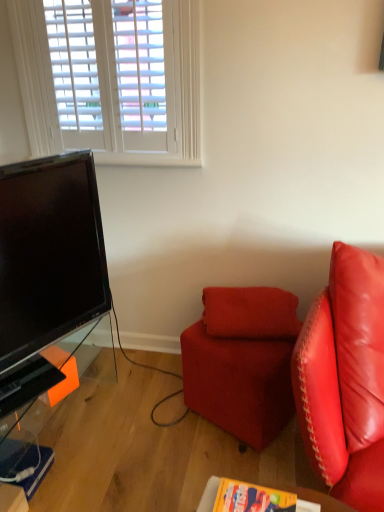
This screenshot has height=512, width=384. Describe the element at coordinates (318, 502) in the screenshot. I see `wooden table at lower center, which ranks as the 1th table in right-to-left order` at that location.

Measure the distance between wooden table at lower center, which ranks as the 1th table in right-to-left order, and camera.

wooden table at lower center, which ranks as the 1th table in right-to-left order, and camera are 1.13 meters apart.

This screenshot has width=384, height=512. I want to click on suede-like red pillow at center, so click(x=250, y=313).

Find the location of a particular element. velvet red ottoman at center is located at coordinates (242, 361).

Looking at this image, from a real-world perspective, is velvet red ottoman at center physically located above or below suede-like red pillow at center?

Clearly, from a real-world perspective, velvet red ottoman at center is below suede-like red pillow at center.

Considering the sizes of objects velvet red ottoman at center and suede-like red pillow at center in the image provided, who is wider, velvet red ottoman at center or suede-like red pillow at center?

Wider between the two is velvet red ottoman at center.

Do you think velvet red ottoman at center is within suede-like red pillow at center, or outside of it?

velvet red ottoman at center lies outside suede-like red pillow at center.

Considering the positions of objects suede-like red pillow at center and velvet red ottoman at center in the image provided, who is more to the left, suede-like red pillow at center or velvet red ottoman at center?

velvet red ottoman at center.

Considering the sizes of objects suede-like red pillow at center and velvet red ottoman at center in the image provided, who is smaller, suede-like red pillow at center or velvet red ottoman at center?

suede-like red pillow at center.

Is suede-like red pillow at center wider or thinner than velvet red ottoman at center?

In the image, suede-like red pillow at center appears to be more narrow than velvet red ottoman at center.

Does velvet red ottoman at center turn towards wooden table at lower center, which appears as the second table when viewed from the left?

No, velvet red ottoman at center is not oriented towards wooden table at lower center, which appears as the second table when viewed from the left.

From a real-world perspective, which object stands above the other?

wooden table at lower center, which appears as the second table when viewed from the left, is physically above.

From the picture: Is velvet red ottoman at center located outside wooden table at lower center, which ranks as the 1th table in right-to-left order?

Yes, velvet red ottoman at center is located beyond the bounds of wooden table at lower center, which ranks as the 1th table in right-to-left order.

Is velvet red ottoman at center touching wooden table at lower center, which ranks as the second table in back-to-front order?

No, velvet red ottoman at center is not touching wooden table at lower center, which ranks as the second table in back-to-front order.

From a real-world perspective, is wooden table at lower center, which appears as the second table when viewed from the left, positioned over suede-like red pillow at center based on gravity?

No, from a real-world perspective, wooden table at lower center, which appears as the second table when viewed from the left, is not above suede-like red pillow at center.

The width and height of the screenshot is (384, 512). In order to click on the 1st table to the left when counting from the suede-like red pillow at center in this screenshot , I will do `click(318, 502)`.

Could suede-like red pillow at center be considered to be inside wooden table at lower center, which ranks as the second table in back-to-front order?

No, suede-like red pillow at center is not a part of wooden table at lower center, which ranks as the second table in back-to-front order.

From the image's perspective, is velvet red ottoman at center below transparent glass table at lower left, which is the 1th table from back to front?

No.

Considering the relative sizes of velvet red ottoman at center and transparent glass table at lower left, which is the 1th table from back to front, in the image provided, is velvet red ottoman at center thinner than transparent glass table at lower left, which is the 1th table from back to front,?

Indeed, velvet red ottoman at center has a lesser width compared to transparent glass table at lower left, which is the 1th table from back to front.

From the image's perspective, which table is the 1st one below the velvet red ottoman at center? Please provide its 2D coordinates.

[(24, 452)]

Does point (285, 348) come behind point (14, 441)?

No, it is not.

Are transparent glass table at lower left, which is the 1th table from back to front, and velvet red ottoman at center located far from each other?

They are positioned close to each other.

Is transparent glass table at lower left, marked as the first table in a left-to-right arrangement, to the right of velvet red ottoman at center from the viewer's perspective?

In fact, transparent glass table at lower left, marked as the first table in a left-to-right arrangement, is to the left of velvet red ottoman at center.

Is velvet red ottoman at center at the back of transparent glass table at lower left, which is the 1th table from back to front?

transparent glass table at lower left, which is the 1th table from back to front, does not have its back to velvet red ottoman at center.

Locate an element on the screen. table that is under the velvet red ottoman at center (from a real-world perspective) is located at coordinates (24, 452).

Is wooden table at lower center, which ranks as the 1th table in right-to-left order, at the left side of transparent glass table at lower left, which is the 1th table from back to front?

No.

Is wooden table at lower center, which ranks as the 1th table in right-to-left order, facing towards transparent glass table at lower left, the second table in the right-to-left sequence?

No, wooden table at lower center, which ranks as the 1th table in right-to-left order, is not turned towards transparent glass table at lower left, the second table in the right-to-left sequence.

From the image's perspective, is wooden table at lower center, which is counted as the first table, starting from the front, above or below transparent glass table at lower left, positioned as the 2th table in front-to-back order?

wooden table at lower center, which is counted as the first table, starting from the front, is situated lower than transparent glass table at lower left, positioned as the 2th table in front-to-back order, in the image.

Can you confirm if wooden table at lower center, which ranks as the second table in back-to-front order, is bigger than transparent glass table at lower left, the second table in the right-to-left sequence?

Incorrect, wooden table at lower center, which ranks as the second table in back-to-front order, is not larger than transparent glass table at lower left, the second table in the right-to-left sequence.

Where is `studio couch directly beneath the suede-like red pillow at center (from a real-world perspective)`? The image size is (384, 512). studio couch directly beneath the suede-like red pillow at center (from a real-world perspective) is located at coordinates (242, 361).

The width and height of the screenshot is (384, 512). What are the coordinates of `studio couch in front of the suede-like red pillow at center` in the screenshot? It's located at (242, 361).

Consider the image. Estimate the real-world distances between objects in this image. Which object is further from velvet red ottoman at center, transparent glass table at lower left, which is the 1th table from back to front, or wooden table at lower center, which ranks as the 1th table in right-to-left order?

transparent glass table at lower left, which is the 1th table from back to front, lies further to velvet red ottoman at center than the other object.

From the image, which object appears to be farther from suede-like red pillow at center, velvet red ottoman at center or transparent glass table at lower left, positioned as the 2th table in front-to-back order?

The object further to suede-like red pillow at center is transparent glass table at lower left, positioned as the 2th table in front-to-back order.

Estimate the real-world distances between objects in this image. Which object is closer to wooden table at lower center, which is counted as the first table, starting from the front, velvet red ottoman at center or transparent glass table at lower left, positioned as the 2th table in front-to-back order?

velvet red ottoman at center lies closer to wooden table at lower center, which is counted as the first table, starting from the front, than the other object.

From the image, which object appears to be nearer to wooden table at lower center, which ranks as the second table in back-to-front order, velvet red ottoman at center or suede-like red pillow at center?

velvet red ottoman at center lies closer to wooden table at lower center, which ranks as the second table in back-to-front order, than the other object.

Based on their spatial positions, is suede-like red pillow at center or wooden table at lower center, which is counted as the first table, starting from the front, further from transparent glass table at lower left, which is the 1th table from back to front?

Among the two, suede-like red pillow at center is located further to transparent glass table at lower left, which is the 1th table from back to front.

Estimate the real-world distances between objects in this image. Which object is further from transparent glass table at lower left, the second table in the right-to-left sequence, wooden table at lower center, which appears as the second table when viewed from the left, or velvet red ottoman at center?

wooden table at lower center, which appears as the second table when viewed from the left, is positioned further to the anchor transparent glass table at lower left, the second table in the right-to-left sequence.

Looking at the image, which one is located closer to transparent glass table at lower left, which is the 1th table from back to front, wooden table at lower center, which is counted as the first table, starting from the front, or suede-like red pillow at center?

wooden table at lower center, which is counted as the first table, starting from the front, is positioned closer to the anchor transparent glass table at lower left, which is the 1th table from back to front.

Based on their spatial positions, is suede-like red pillow at center or velvet red ottoman at center closer to transparent glass table at lower left, which is the 1th table from back to front?

Among the two, velvet red ottoman at center is located nearer to transparent glass table at lower left, which is the 1th table from back to front.

Identify the location of table located between transparent glass table at lower left, marked as the first table in a left-to-right arrangement, and suede-like red pillow at center in the left-right direction. (318, 502).

Image resolution: width=384 pixels, height=512 pixels. I want to click on table between transparent glass table at lower left, which is the 1th table from back to front, and velvet red ottoman at center, so click(318, 502).

The width and height of the screenshot is (384, 512). I want to click on studio couch between transparent glass table at lower left, the second table in the right-to-left sequence, and suede-like red pillow at center from left to right, so click(x=242, y=361).

The image size is (384, 512). What are the coordinates of `studio couch between wooden table at lower center, which appears as the second table when viewed from the left, and suede-like red pillow at center, along the z-axis` in the screenshot? It's located at (242, 361).